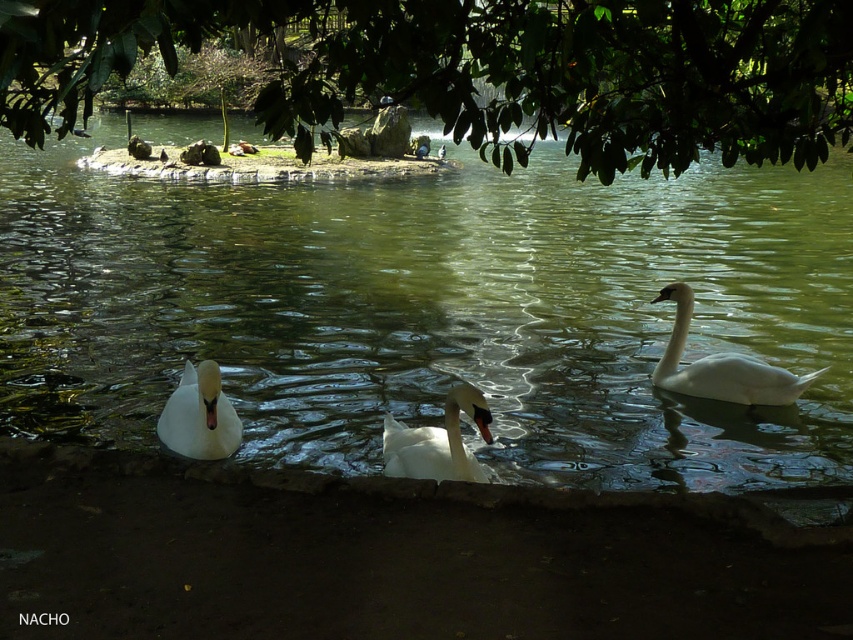
In the scene shown: Which of these two, green leafy tree at upper center or white glossy swan at right, stands taller?

white glossy swan at right is taller.

Which is above, green leafy tree at upper center or white glossy swan at right?

green leafy tree at upper center is higher up.

Is point (431, 16) positioned after point (688, 294)?

No, (431, 16) is closer to viewer.

Image resolution: width=853 pixels, height=640 pixels. Find the location of `green leafy tree at upper center`. green leafy tree at upper center is located at coordinates (482, 68).

Does point (791, 381) come behind point (210, 419)?

Yes.

Is white glossy swan at right below white glossy swan at lower left?

No.

Is point (680, 353) behind point (175, 408)?

Yes, it is.

What are the coordinates of `white glossy swan at right` in the screenshot? It's located at (721, 365).

Between white glossy swan at right and white glossy swan at center, which one is positioned higher?

white glossy swan at right is above.

Between point (663, 387) and point (482, 474), which one is positioned behind?

The point (663, 387) is more distant.

The height and width of the screenshot is (640, 853). What are the coordinates of `white glossy swan at right` in the screenshot? It's located at (721, 365).